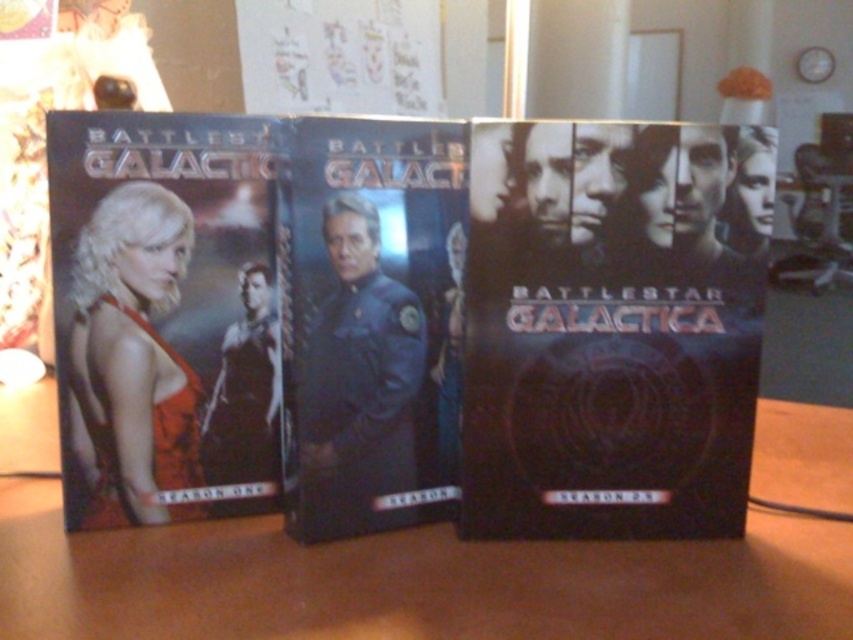
Does black matte dvd at center have a greater width compared to matte orange dress at left?

Indeed, black matte dvd at center has a greater width compared to matte orange dress at left.

Does point (627, 189) come in front of point (125, 426)?

Yes, point (627, 189) is closer to viewer.

Is point (683, 211) positioned in front of point (212, 125)?

Yes, it is.

The width and height of the screenshot is (853, 640). In order to click on black matte dvd at center in this screenshot , I will do `click(605, 333)`.

Is matte orange dress at left bigger than shiny blue uniform at center?

Incorrect, matte orange dress at left is not larger than shiny blue uniform at center.

Which is in front, point (207, 164) or point (451, 308)?

Point (207, 164)

Is point (126, 141) farther from camera compared to point (312, 180)?

That is True.

Locate an element on the screen. matte orange dress at left is located at coordinates (164, 314).

Can you confirm if wooden table at center is positioned to the left of matte orange dress at left?

No, wooden table at center is not to the left of matte orange dress at left.

Who is positioned more to the left, wooden table at center or matte orange dress at left?

Positioned to the left is matte orange dress at left.

Is point (196, 596) farther from viewer compared to point (248, 500)?

No, it is in front of (248, 500).

The width and height of the screenshot is (853, 640). Find the location of `wooden table at center`. wooden table at center is located at coordinates (410, 582).